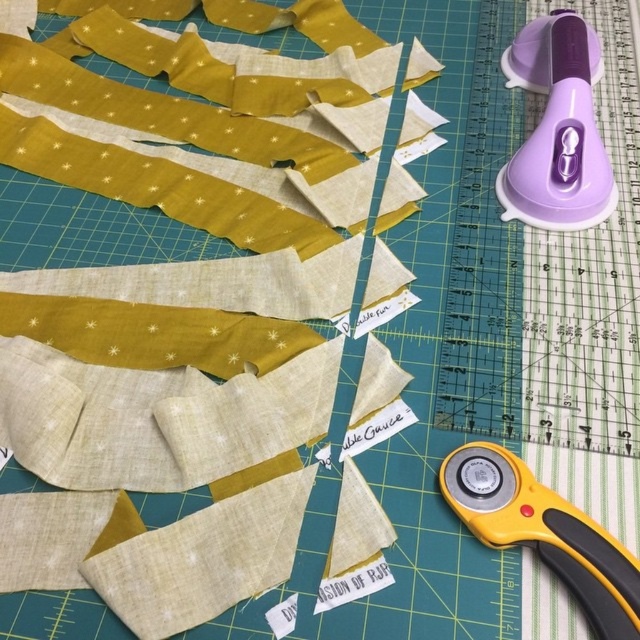
You are organizing the tools on the green cutting mat. You need to place the purple plastic rotary cutter at upper right and the yellow plastic rotary cutter at lower right. According to their current positions, which one is closer to the top edge of the mat?

The purple plastic rotary cutter at upper right is closer to the top edge of the mat because it is positioned over the yellow plastic rotary cutter at lower right, meaning it is higher up on the mat.